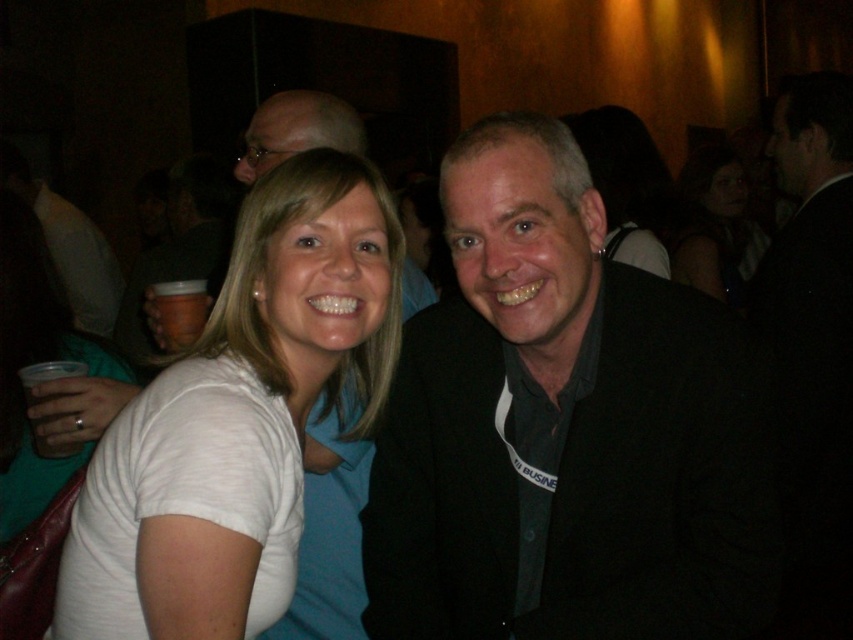
Is black suit at right in front of clear plastic cup at left?

No, black suit at right is further to the viewer.

Can you confirm if black suit at right is thinner than clear plastic cup at left?

No.

Between point (838, 518) and point (36, 378), which one is positioned behind?

The point (838, 518) is behind.

I want to click on black suit at right, so click(811, 348).

Does white cotton t-shirt at center have a larger size compared to smooth skin face at upper right?

Incorrect, white cotton t-shirt at center is not larger than smooth skin face at upper right.

Which is in front, point (61, 611) or point (733, 156)?

Point (61, 611) is in front.

The height and width of the screenshot is (640, 853). I want to click on white cotton t-shirt at center, so click(239, 417).

Does white cotton t-shirt at center appear over clear plastic cup at left?

No.

Who is more distant from viewer, (x=357, y=193) or (x=38, y=435)?

The point (x=38, y=435) is more distant.

Find the location of `white cotton t-shirt at center`. white cotton t-shirt at center is located at coordinates (239, 417).